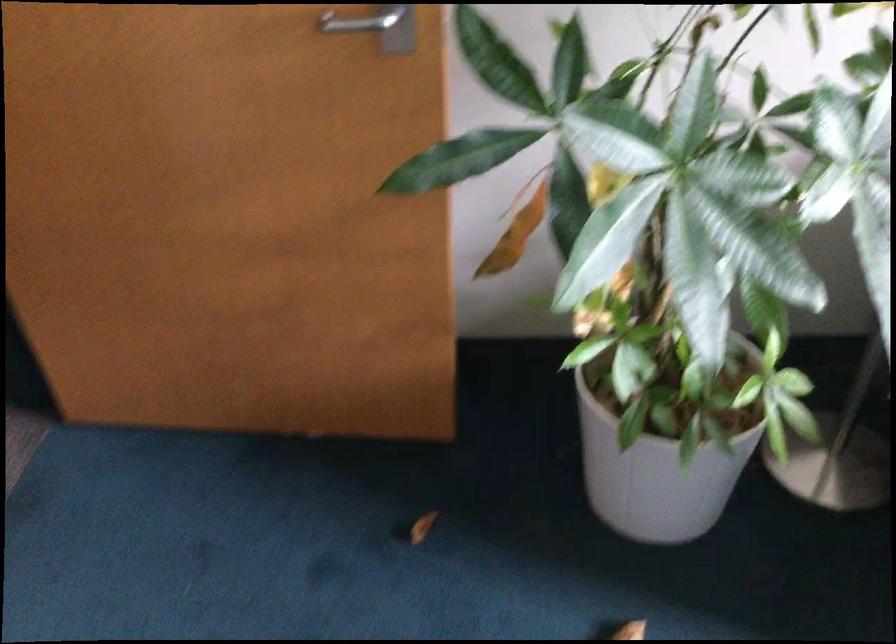
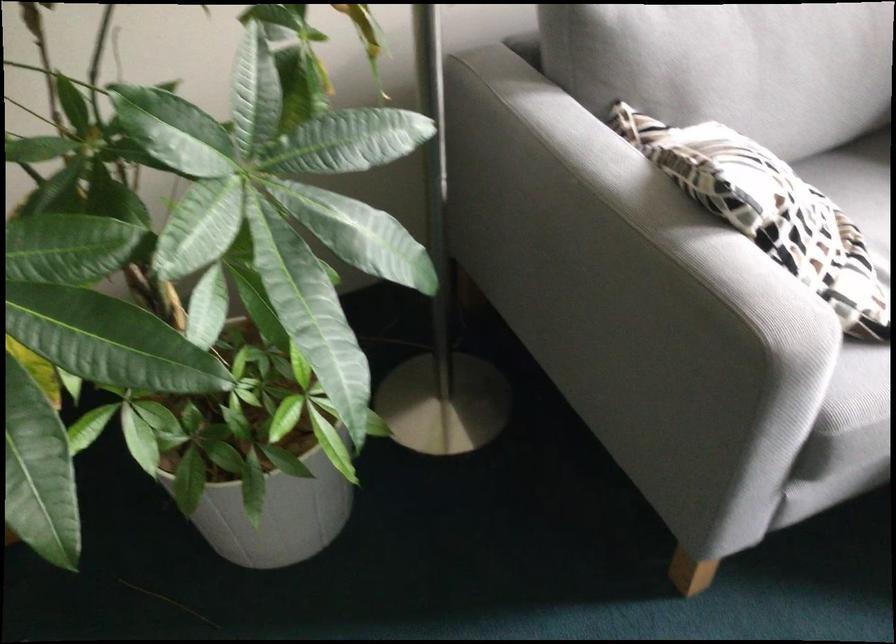
Where in the second image is the point corresponding to (x=668, y=474) from the first image?

(273, 506)